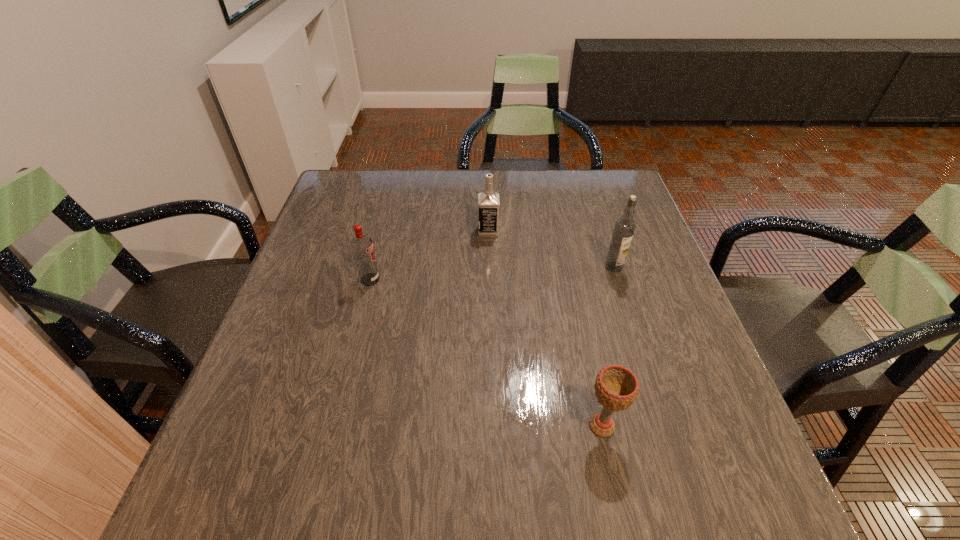
Identify the location of the rightmost object. (624, 228).

Image resolution: width=960 pixels, height=540 pixels. Find the location of `the tallest vodka`. the tallest vodka is located at coordinates (624, 228).

This screenshot has height=540, width=960. What are the coordinates of `the second object from left to right` in the screenshot? It's located at (488, 202).

This screenshot has height=540, width=960. Find the location of `the farthest vodka`. the farthest vodka is located at coordinates (488, 202).

This screenshot has width=960, height=540. I want to click on the leftmost object, so click(x=362, y=248).

I want to click on the nearest object, so click(x=616, y=387).

Where is `chalice`? The height and width of the screenshot is (540, 960). chalice is located at coordinates coord(616,387).

Locate an element on the screen. This screenshot has height=540, width=960. vacant space situated on the label of the rightmost vodka is located at coordinates (657, 401).

The width and height of the screenshot is (960, 540). I want to click on vacant space located 0.220m on the front label of the second vodka from left to right, so click(x=397, y=231).

I want to click on vacant region located on the front label of the second vodka from left to right, so click(445, 231).